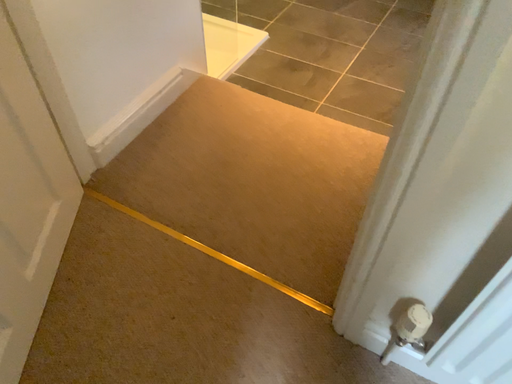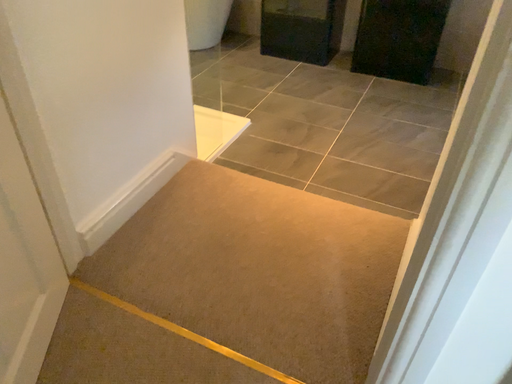
Question: Which way did the camera rotate in the video?

Choices:
 (A) rotated upward
 (B) rotated downward

Answer: (A)